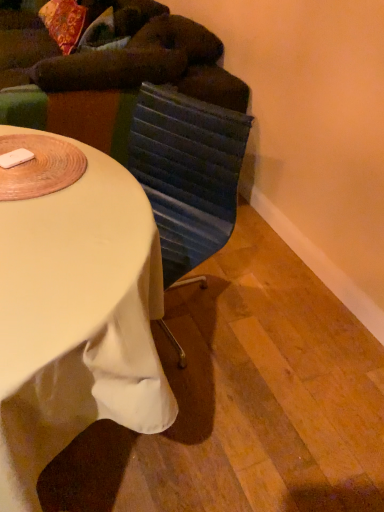
Question: Considering the positions of dark green fabric bean bag chair at upper left and textured blue swivel chair at center in the image, is dark green fabric bean bag chair at upper left bigger or smaller than textured blue swivel chair at center?

Choices:
 (A) small
 (B) big

Answer: (B)

Question: Is dark green fabric bean bag chair at upper left spatially inside textured blue swivel chair at center, or outside of it?

Choices:
 (A) outside
 (B) inside

Answer: (A)

Question: Considering the real-world distances, which object is closest to the textured blue swivel chair at center?

Choices:
 (A) dark green fabric bean bag chair at upper left
 (B) white fabric-covered desk at center

Answer: (B)

Question: Estimate the real-world distances between objects in this image. Which object is closer to the dark green fabric bean bag chair at upper left?

Choices:
 (A) white fabric-covered desk at center
 (B) textured blue swivel chair at center

Answer: (B)